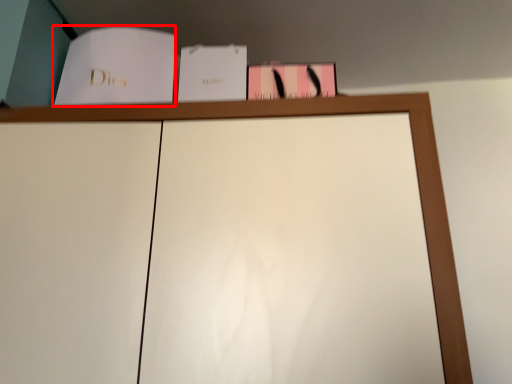
Question: From the image's perspective, what is the correct spatial positioning of paperback book (annotated by the red box) in reference to paperback book?

Choices:
 (A) below
 (B) above

Answer: (B)